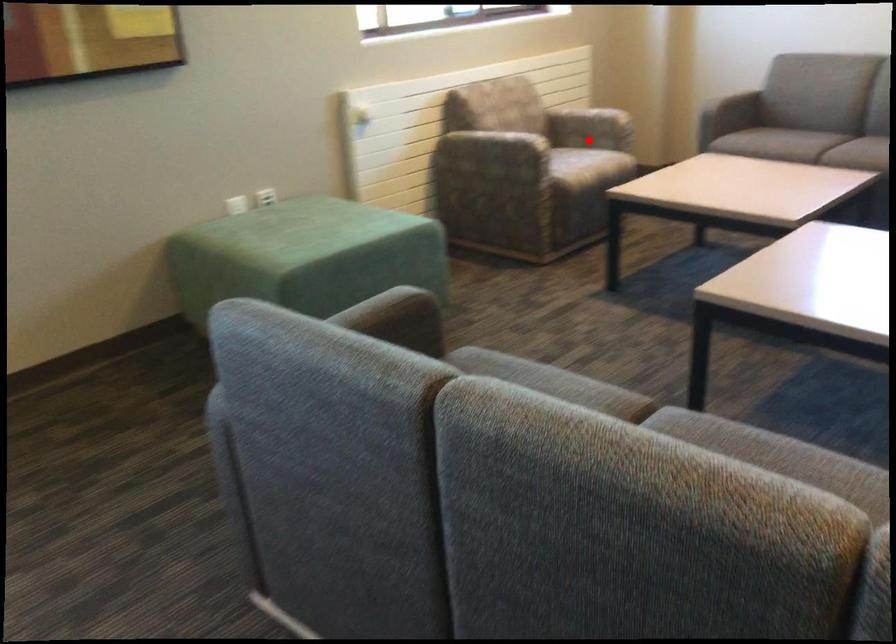
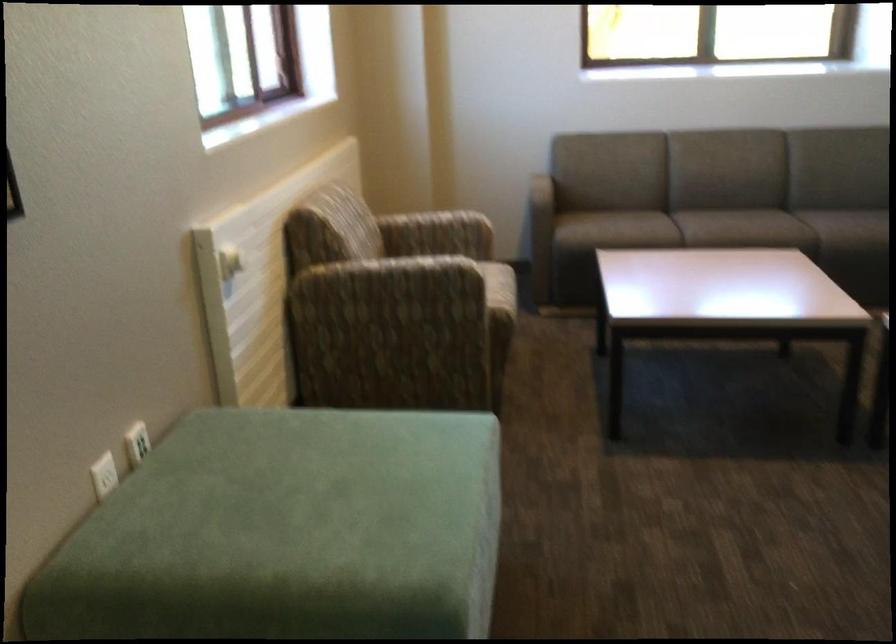
The point at the highlighted location is marked in the first image. Where is the corresponding point in the second image?

(458, 254)